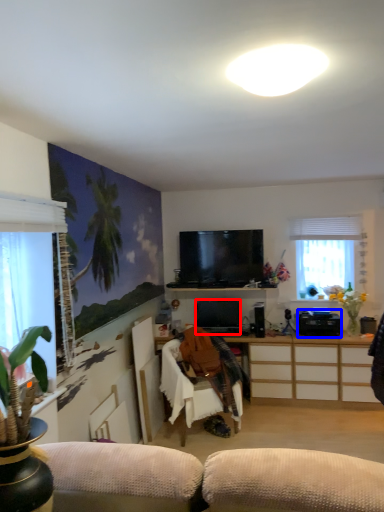
Question: Which point is closer to the camera, television (highlighted by a red box) or appliance (highlighted by a blue box)?

Choices:
 (A) television
 (B) appliance

Answer: (B)